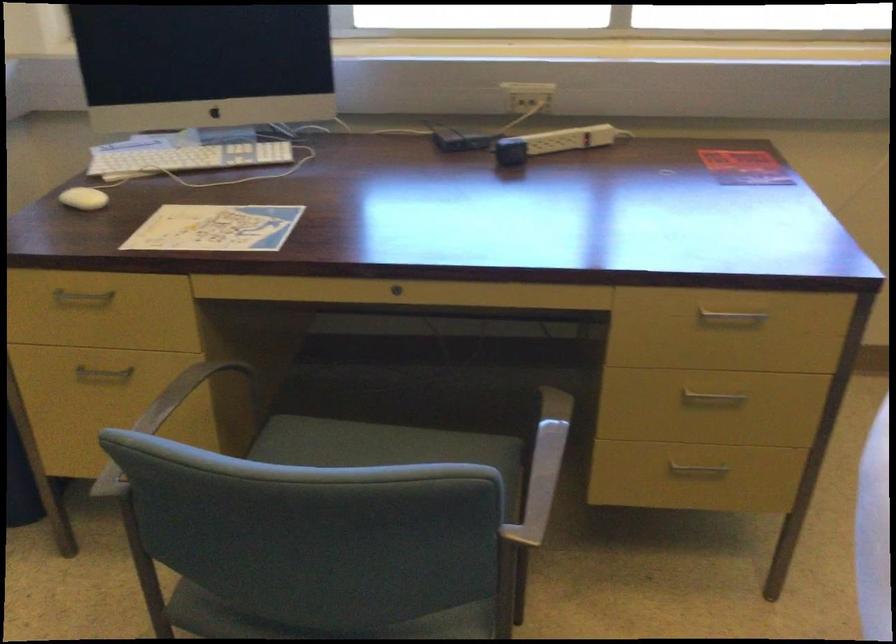
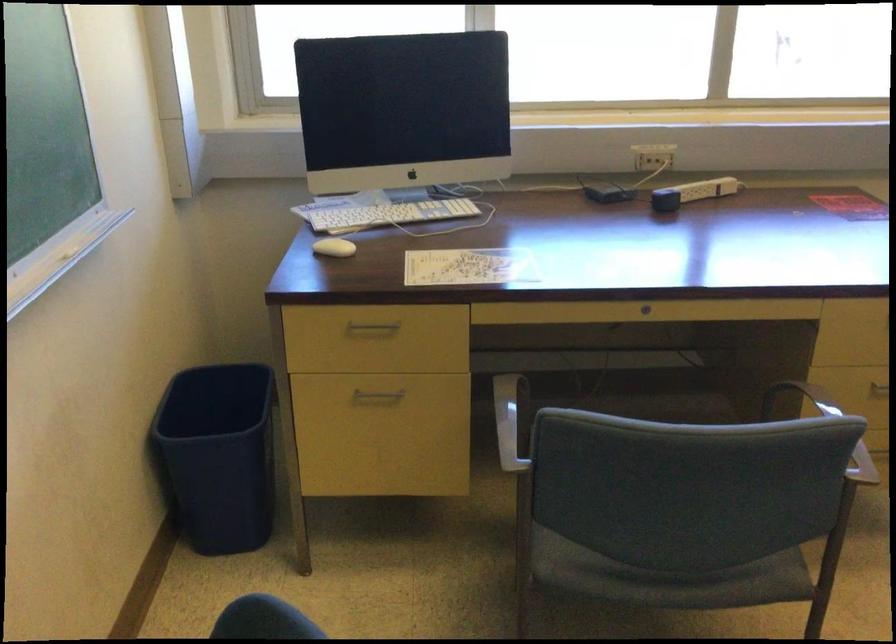
In the second image, find the point that corresponds to (108,375) in the first image.

(376, 395)